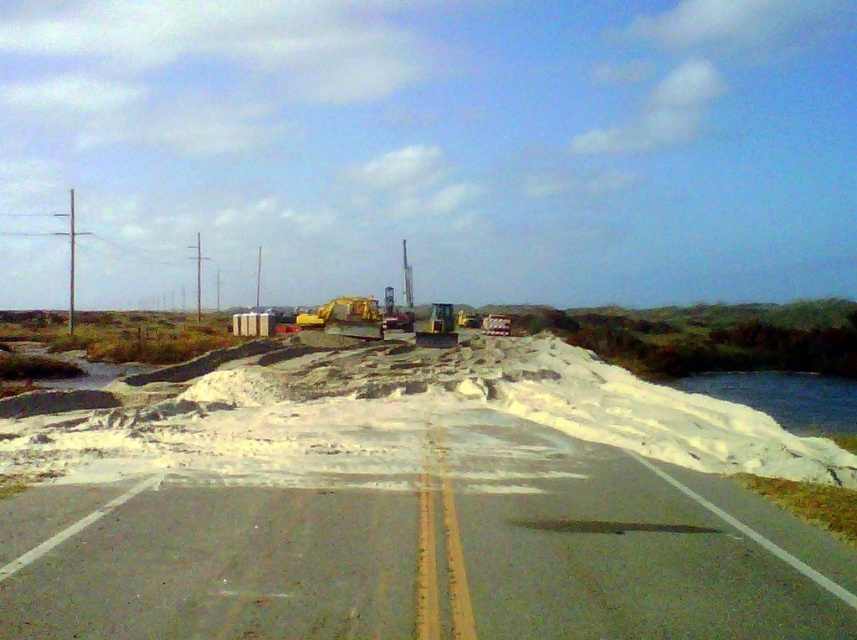
You are a delivery driver who needs to drive a truck that is 10 meters long through the gray asphalt highway at center and the yellow rubber tractor at center. Based on their sizes, can your truck pass through both objects without any issues?

The gray asphalt highway at center occupies less space than the yellow rubber tractor at center. Since your truck is 10 meters long, it may not fit through the gray asphalt highway at center if it is narrower. However, the yellow rubber tractor at center might provide enough space. Check both areas carefully before proceeding.

You are a delivery driver approaching the gray asphalt highway at center and the white snow at lower right. Which one is closer to your current position?

The gray asphalt highway at center is closer because it is in front of the white snow at lower right.

You are a construction worker who needs to place a safety cone exactly at the center of the gray asphalt highway at center. According to the coordinates provided, where should you place the cone?

The gray asphalt highway at center is located at point (423, 550), so you should place the safety cone at those coordinates to mark its center.